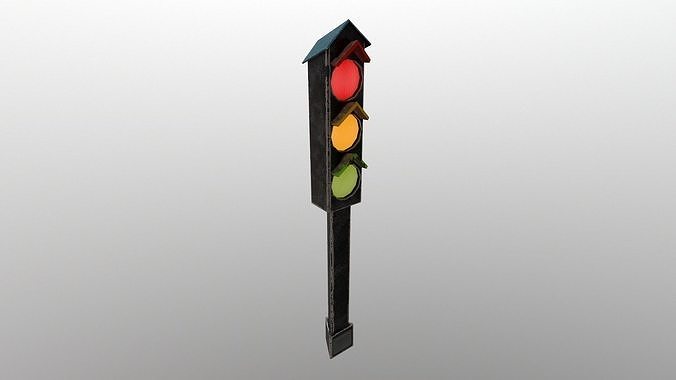
What are the coordinates of `yellow light` in the screenshot? It's located at coord(352,131).